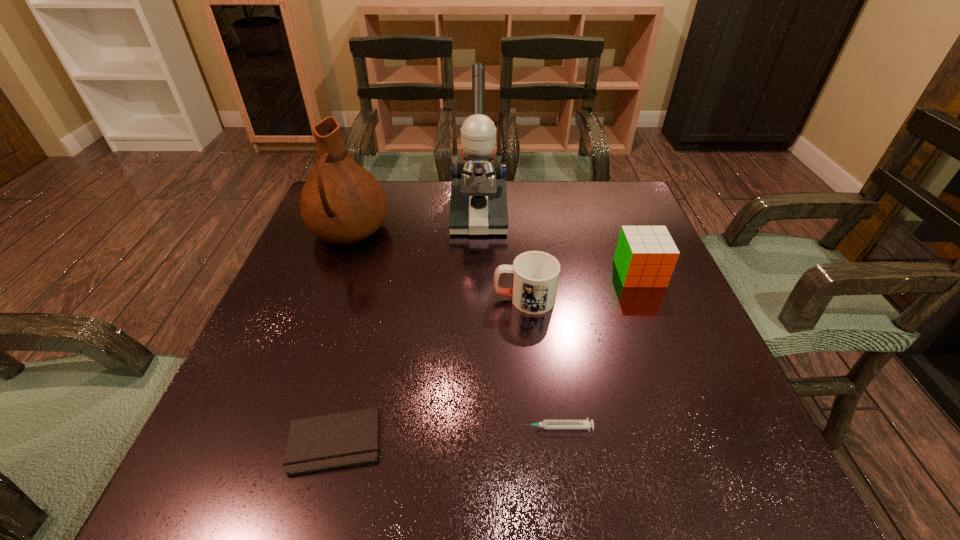
Image resolution: width=960 pixels, height=540 pixels. Find the location of `the tallest object`. the tallest object is located at coordinates 478,204.

The image size is (960, 540). What are the coordinates of `pitcher` in the screenshot? It's located at (341, 202).

This screenshot has height=540, width=960. Find the location of `cube`. cube is located at coordinates [645, 256].

This screenshot has height=540, width=960. Identify the location of mug. (535, 278).

The image size is (960, 540). Identify the location of syringe. (546, 424).

The width and height of the screenshot is (960, 540). What are the coordinates of `checkbook` in the screenshot? It's located at (337, 440).

Where is `free space located 0.160m on the right of the microscope`? Image resolution: width=960 pixels, height=540 pixels. free space located 0.160m on the right of the microscope is located at coordinates (565, 215).

Where is `vacant space located on the side of the fifth shortest object with the handle`? vacant space located on the side of the fifth shortest object with the handle is located at coordinates click(x=301, y=360).

The height and width of the screenshot is (540, 960). In order to click on vacant space situated 0.290m on the back of the rightmost object in this screenshot , I will do `click(608, 195)`.

Locate an element on the screen. The image size is (960, 540). vacant space situated 0.120m on the side of the mug with the handle is located at coordinates (438, 299).